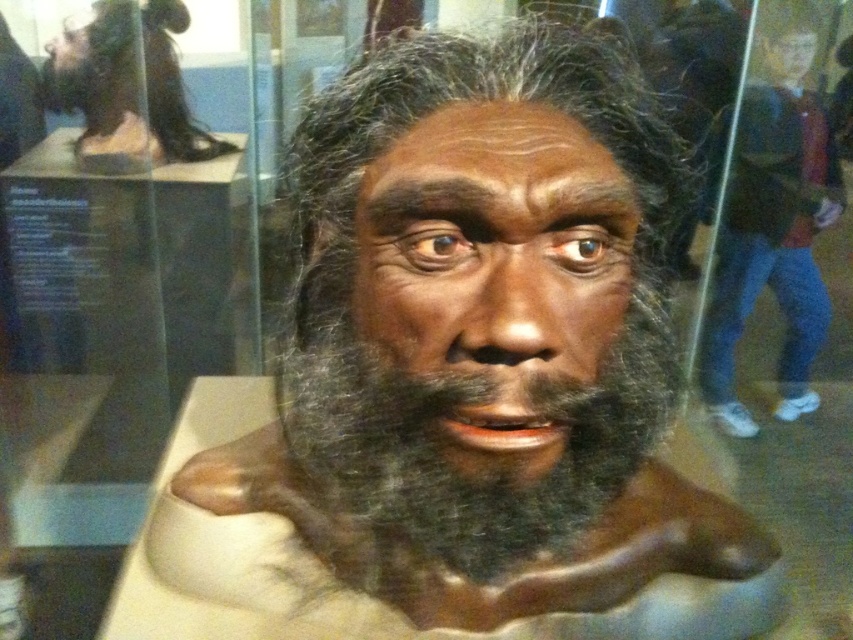
Question: Is brown matte sculpture at center thinner than dark brown fur at center?

Choices:
 (A) no
 (B) yes

Answer: (A)

Question: Can you confirm if blue jeans at right is positioned to the right of matte brown bust at center?

Choices:
 (A) no
 (B) yes

Answer: (B)

Question: Which point is closer to the camera taking this photo?

Choices:
 (A) (442, 129)
 (B) (312, 454)
 (C) (776, 76)

Answer: (A)

Question: Does matte brown face at center have a smaller size compared to matte brown bust at center?

Choices:
 (A) yes
 (B) no

Answer: (B)

Question: Which of the following is the closest to the observer?

Choices:
 (A) (720, 269)
 (B) (163, 148)

Answer: (B)

Question: Which of the following is the farthest from the observer?

Choices:
 (A) matte brown face at center
 (B) blue jeans at right

Answer: (B)